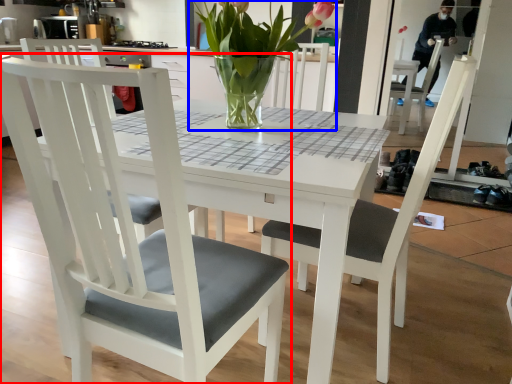
Question: Which object is closer to the camera taking this photo, chair (highlighted by a red box) or houseplant (highlighted by a blue box)?

Choices:
 (A) chair
 (B) houseplant

Answer: (A)